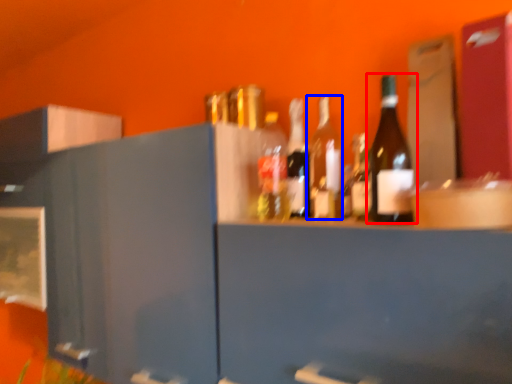
Question: Which object appears farthest to the camera in this image, bottle (highlighted by a red box) or bottle (highlighted by a blue box)?

Choices:
 (A) bottle
 (B) bottle

Answer: (B)